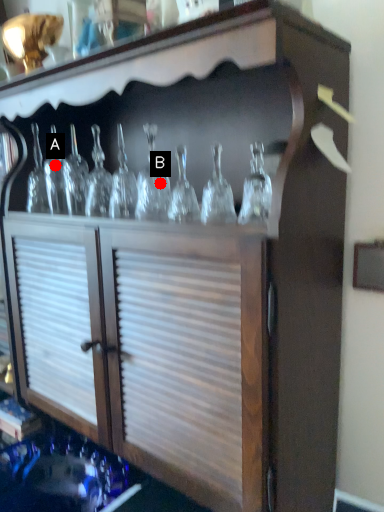
Question: Two points are circled on the image, labeled by A and B beside each circle. Among these points, which one is nearest to the camera?

Choices:
 (A) A is closer
 (B) B is closer

Answer: (B)